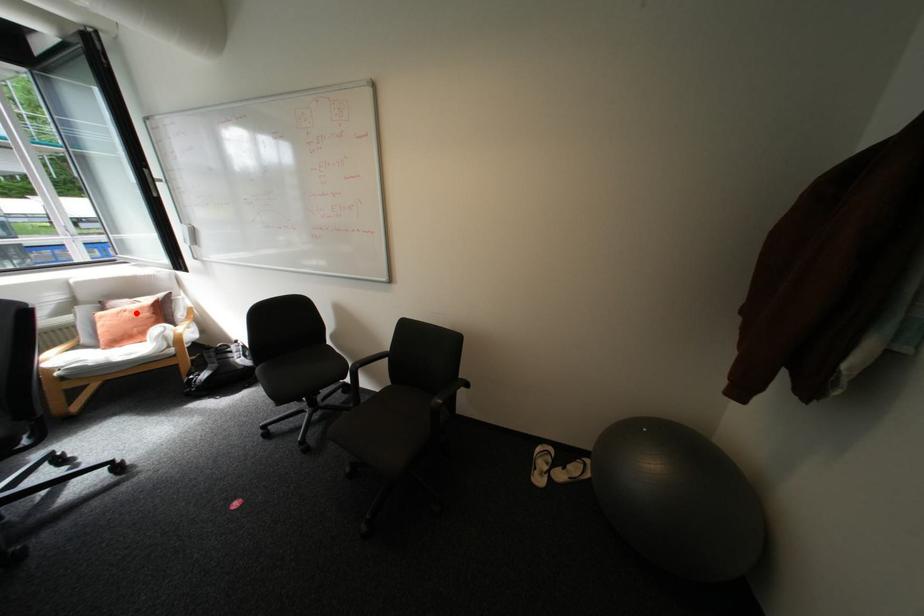
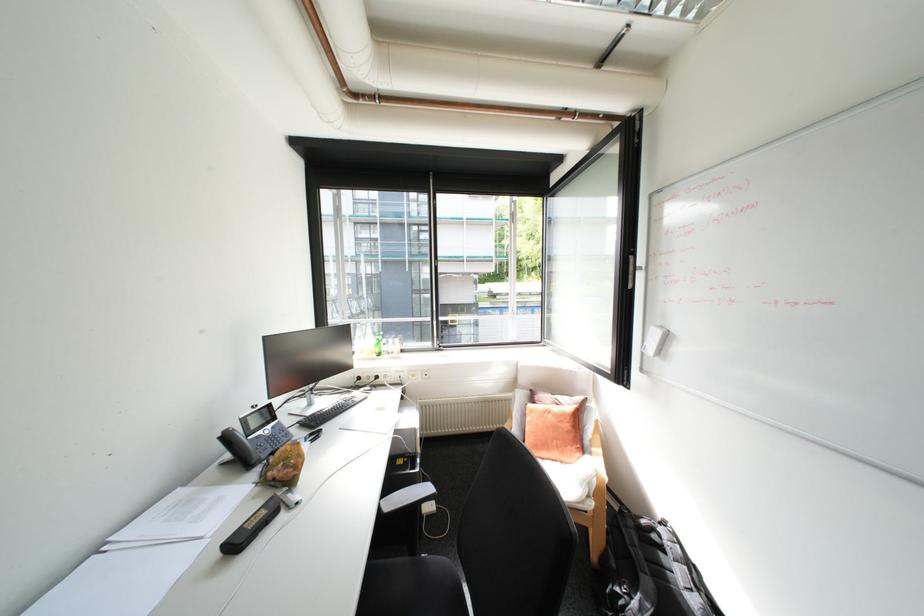
Question: I am providing you with two images of the same scene from different viewpoints. A red point is marked on the first image. Is the red point's position out of view in image 2?

Choices:
 (A) Yes
 (B) No

Answer: (B)